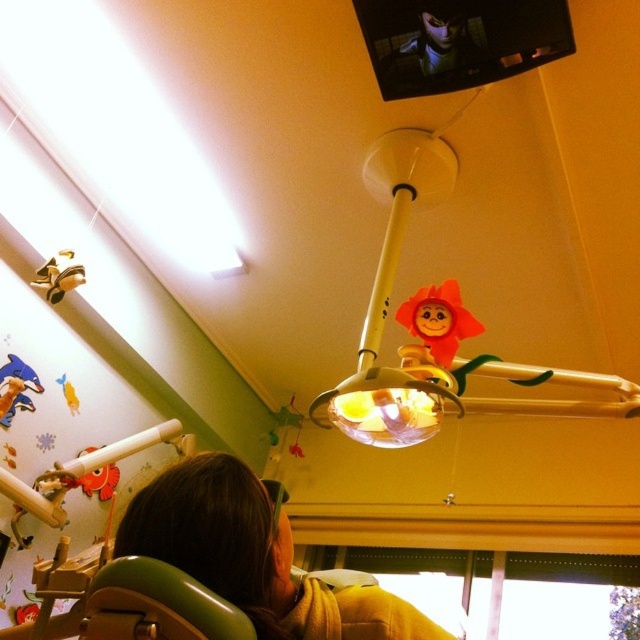
Question: Is brown fabric at lower center wider than translucent plastic lamp at center?

Choices:
 (A) no
 (B) yes

Answer: (A)

Question: Is translucent plastic lamp at center closer to camera compared to matte plastic doll at center?

Choices:
 (A) no
 (B) yes

Answer: (B)

Question: Considering the relative positions of translucent plastic lamp at center and matte plastic doll at center in the image provided, where is translucent plastic lamp at center located with respect to matte plastic doll at center?

Choices:
 (A) left
 (B) right

Answer: (B)

Question: Based on their relative distances, which object is nearer to the green plastic chair at lower left?

Choices:
 (A) brown fabric at lower center
 (B) matte plastic doll at center

Answer: (A)

Question: Which is nearer to the brown fabric at lower center?

Choices:
 (A) translucent plastic lamp at center
 (B) metallic ring at upper center
 (C) matte plastic doll at center
 (D) green plastic chair at lower left

Answer: (D)

Question: Which of the following is the farthest from the observer?

Choices:
 (A) brown fabric at lower center
 (B) green plastic chair at lower left

Answer: (A)